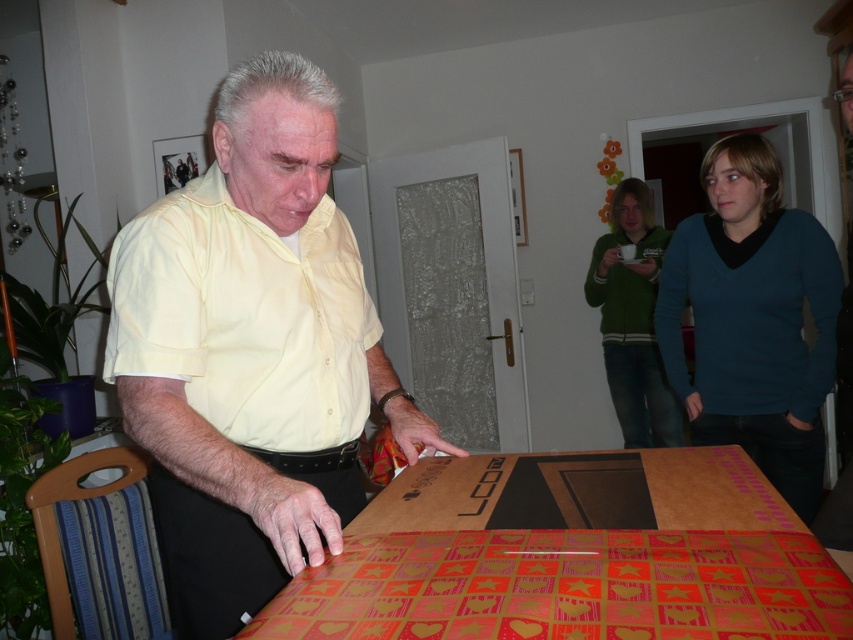
You are organizing a gift wrapping station in the living room. You have a cardboard wrapping paper at lower center and a green fleece jacket at upper center. Which item should you place closer to the edge of the table to ensure there is enough space for both items?

The green fleece jacket at upper center should be placed closer to the edge of the table since it is narrower than the cardboard wrapping paper at lower center, allowing both items to fit comfortably on the table.

Consider the image. You are a fashion designer observing the indoor scene. You notice the teal sweater at center and the green fleece jacket at upper center. Which clothing item is shorter in height?

The teal sweater at center has a lesser height compared to the green fleece jacket at upper center, so the teal sweater at center is shorter in height.

You are a delivery person who just arrived at the scene. You need to place a small package on the cardboard wrapping paper at lower center. Can you estimate how far you need to walk forward from your current position to reach it?

The cardboard wrapping paper at lower center is 60.76 centimeters away from the camera, so you need to walk forward approximately 60.76 centimeters to reach it.